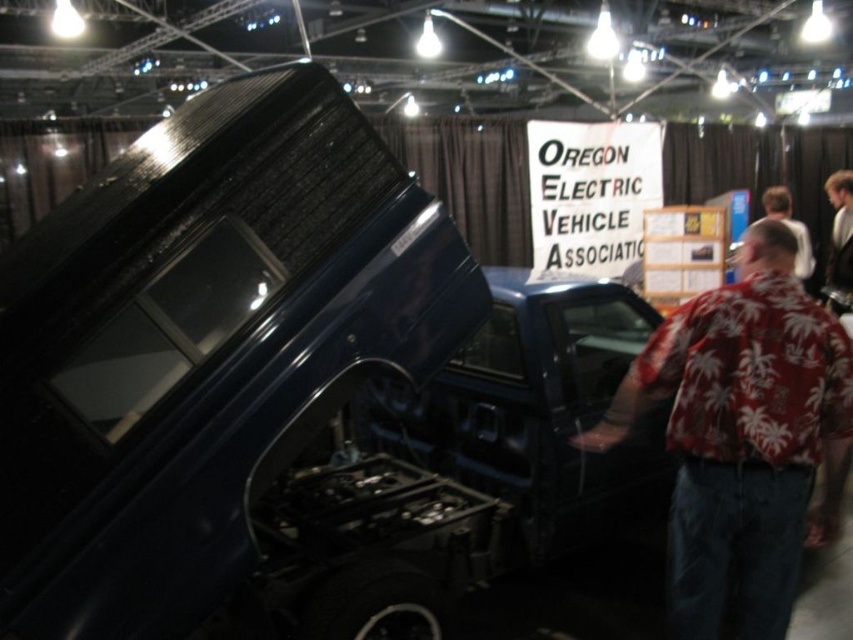
Question: Does glossy blue truck at center have a greater width compared to shiny black car at center?

Choices:
 (A) no
 (B) yes

Answer: (B)

Question: Which is nearer to the glossy blue truck at center?

Choices:
 (A) red palm print shirt at center
 (B) white shirt at right

Answer: (A)

Question: Which point is closer to the camera?

Choices:
 (A) white shirt at right
 (B) shiny black car at center

Answer: (B)

Question: Which point is closer to the camera?

Choices:
 (A) glossy blue truck at center
 (B) white shirt at right
 (C) red palm print shirt at center
 (D) white paper sign at upper center

Answer: (A)

Question: Can you confirm if glossy blue truck at center is smaller than white shirt at right?

Choices:
 (A) no
 (B) yes

Answer: (A)

Question: From the image, what is the correct spatial relationship of glossy blue truck at center in relation to white paper sign at upper center?

Choices:
 (A) right
 (B) left

Answer: (B)